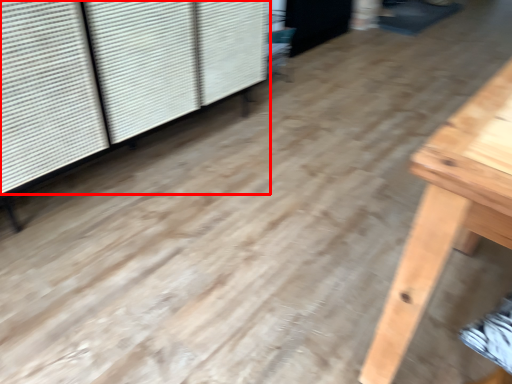
Question: From the image's perspective, what is the correct spatial relationship of shutter (annotated by the red box) in relation to screen door?

Choices:
 (A) above
 (B) below

Answer: (B)